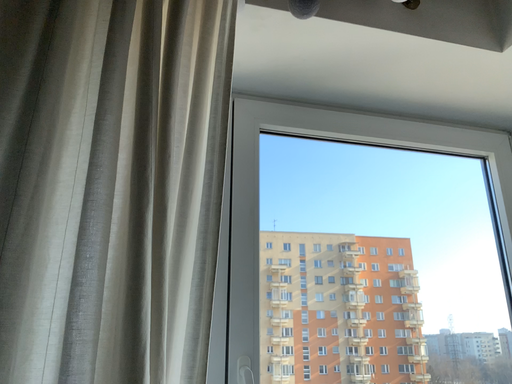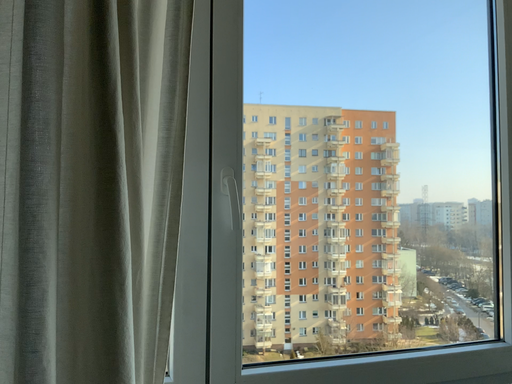
Question: Which way did the camera rotate in the video?

Choices:
 (A) rotated downward
 (B) rotated upward

Answer: (A)